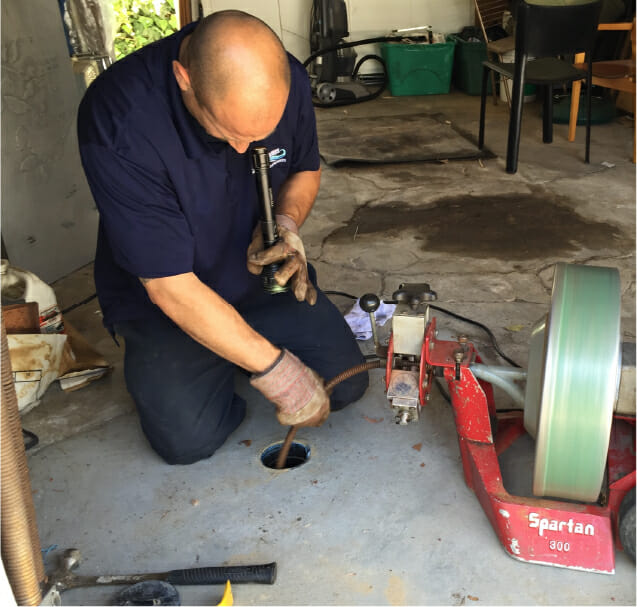
Find the location of a particular element. The image size is (637, 607). wall to the right of the man (his perspective) is located at coordinates (41, 113).